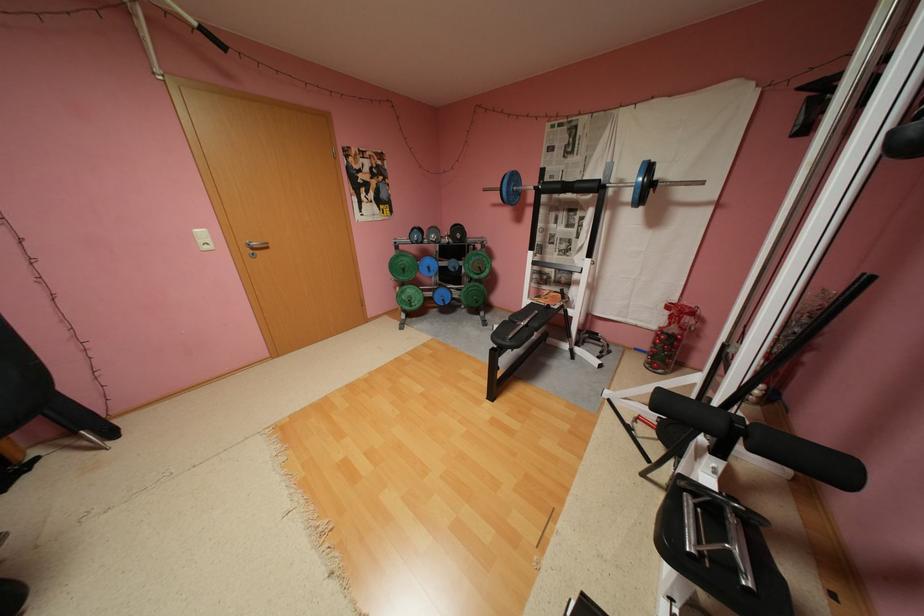
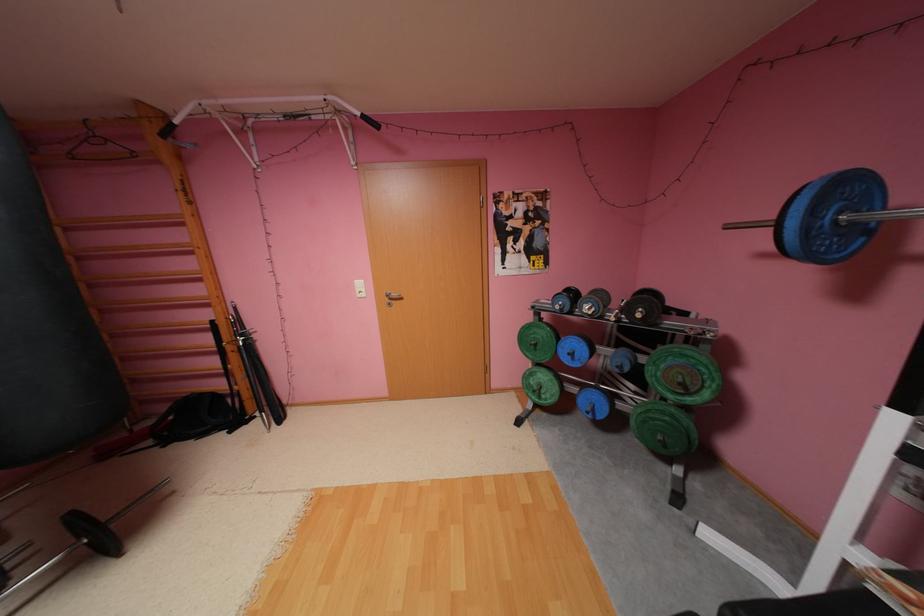
The point at (262,249) is marked in the first image. Where is the corresponding point in the second image?

(399, 299)